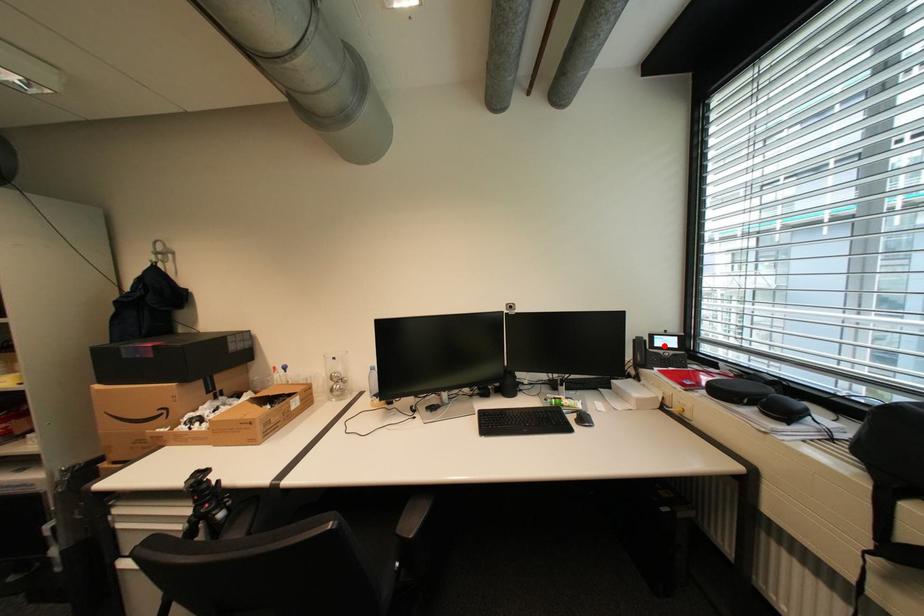
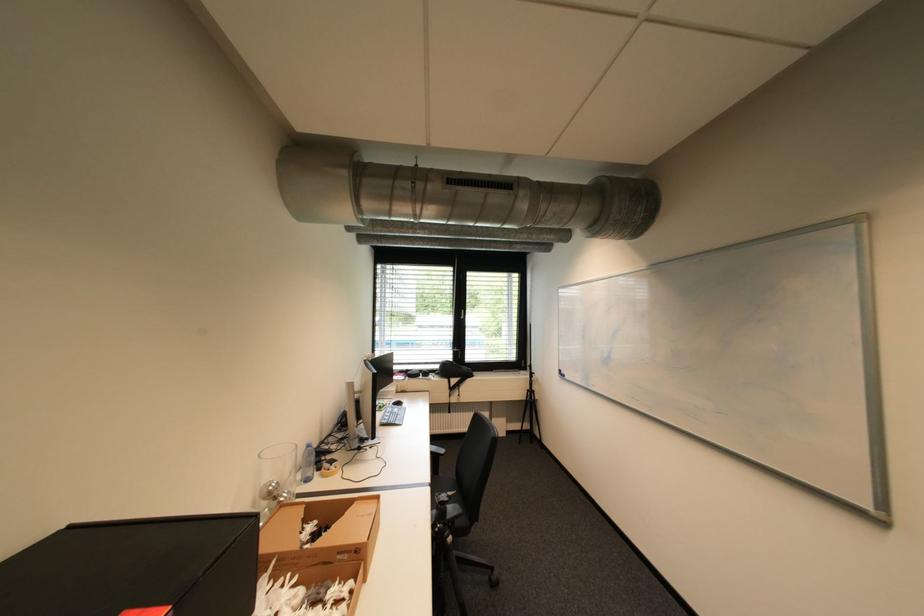
Question: I am providing you with two images of the same scene from different viewpoints. A red point is marked on the first image. Is the red point's position out of view in image 2?

Choices:
 (A) Yes
 (B) No

Answer: (A)